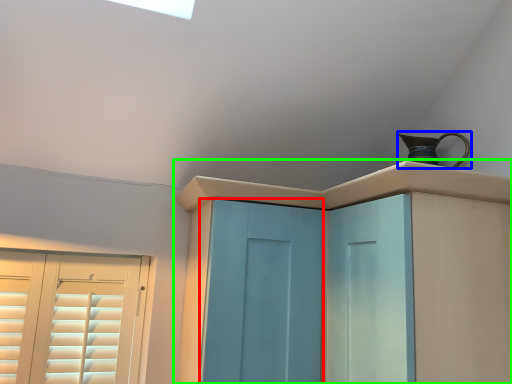
Question: Which object is positioned closest to screen door (highlighted by a red box)? Select from jug (highlighted by a blue box) and cupboard (highlighted by a green box).

Choices:
 (A) jug
 (B) cupboard

Answer: (B)